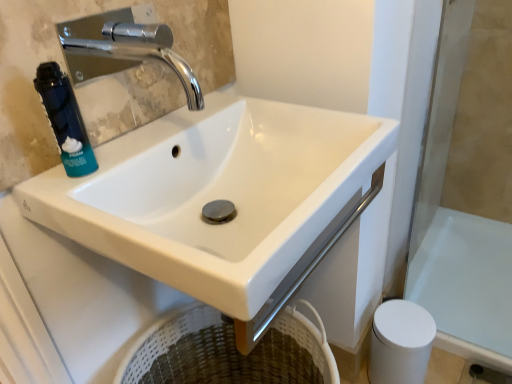
Where is `free spot in front of blue matte foam canister at left`? free spot in front of blue matte foam canister at left is located at coordinates (85, 215).